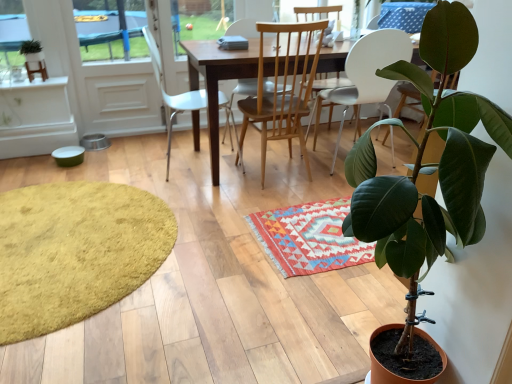
Find the location of a particular element. This screenshot has width=512, height=384. vacant space behind light wood/wooden chair at center, acting as the 2th chair starting from the left is located at coordinates (259, 147).